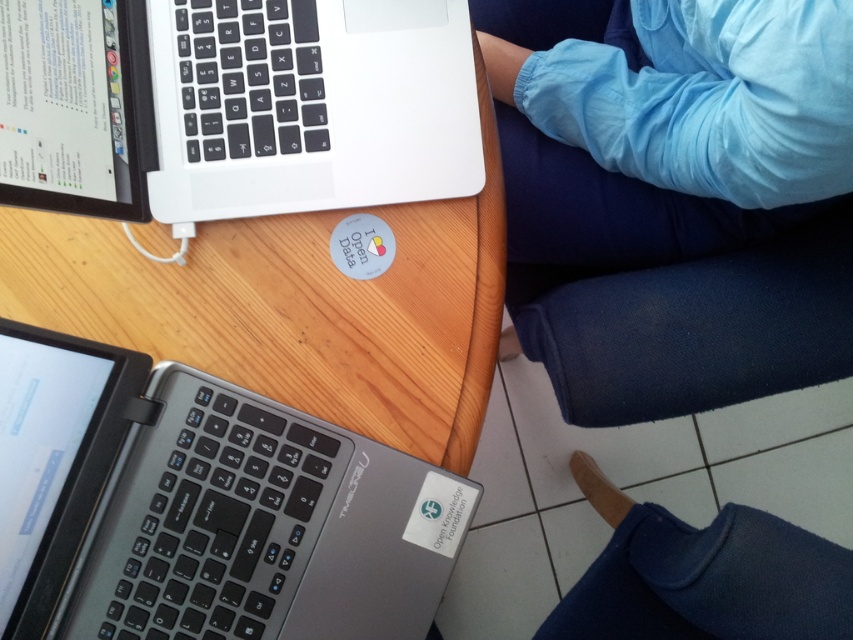
Does blue fabric pants at lower right appear over blue fabric leg at lower right?

Yes.

Which is below, blue fabric pants at lower right or blue fabric leg at lower right?

Positioned lower is blue fabric leg at lower right.

Who is more forward, (521, 234) or (660, 552)?

Positioned in front is point (660, 552).

Locate an element on the screen. The image size is (853, 640). blue fabric pants at lower right is located at coordinates (671, 205).

Does blue fabric pants at lower right appear on the left side of silver metallic laptop at lower left?

No, blue fabric pants at lower right is not to the left of silver metallic laptop at lower left.

Locate an element on the screen. blue fabric pants at lower right is located at coordinates (671, 205).

The image size is (853, 640). Describe the element at coordinates (202, 508) in the screenshot. I see `silver metallic laptop at lower left` at that location.

Does point (210, 502) lie in front of point (723, 515)?

Yes, point (210, 502) is closer to viewer.

Describe the element at coordinates (202, 508) in the screenshot. The image size is (853, 640). I see `silver metallic laptop at lower left` at that location.

At what (x,y) coordinates should I click in order to perform the action: click on silver metallic laptop at lower left. Please return your answer as a coordinate pair (x, y). The width and height of the screenshot is (853, 640). Looking at the image, I should click on pos(202,508).